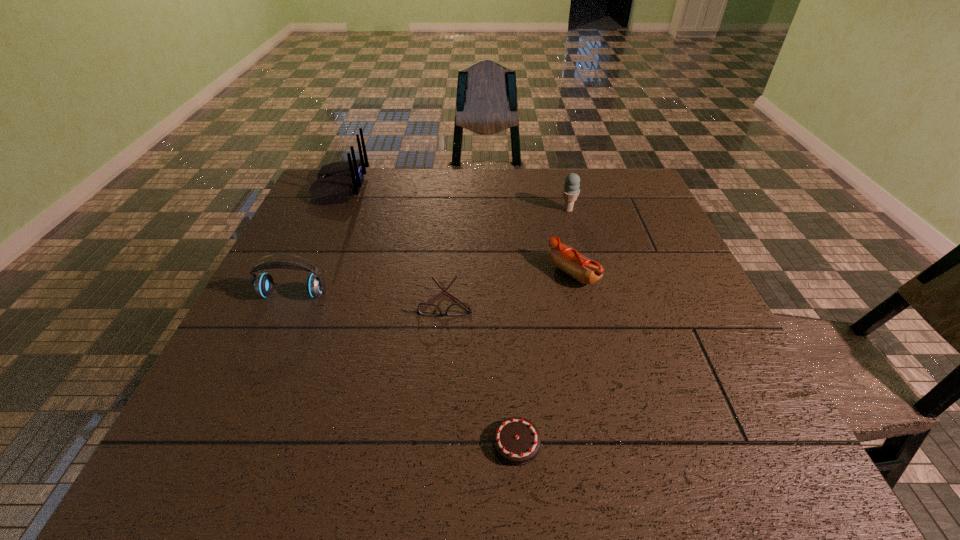
Find the location of `router`. router is located at coordinates (336, 182).

The image size is (960, 540). I want to click on ice cream, so click(571, 190).

Image resolution: width=960 pixels, height=540 pixels. In order to click on headset in this screenshot , I will do `click(263, 284)`.

Locate an element on the screen. sausage is located at coordinates (585, 270).

The image size is (960, 540). I want to click on the third object from left to right, so tap(427, 309).

Find the location of a particular element. spectacles is located at coordinates (427, 309).

You are a GUI agent. You are given a task and a screenshot of the screen. Output one action in this format:
    pyautogui.click(x=<x>, y=<y>)
    Task: Click on the nearest object
    
    Given the screenshot: What is the action you would take?
    pyautogui.click(x=516, y=440)

Where is `chocolate cake`? chocolate cake is located at coordinates (516, 440).

Locate an element on the screen. The height and width of the screenshot is (540, 960). vacant region located on the back of the router is located at coordinates point(413,186).

Locate an element on the screen. free space located on the left of the ice cream is located at coordinates (431, 210).